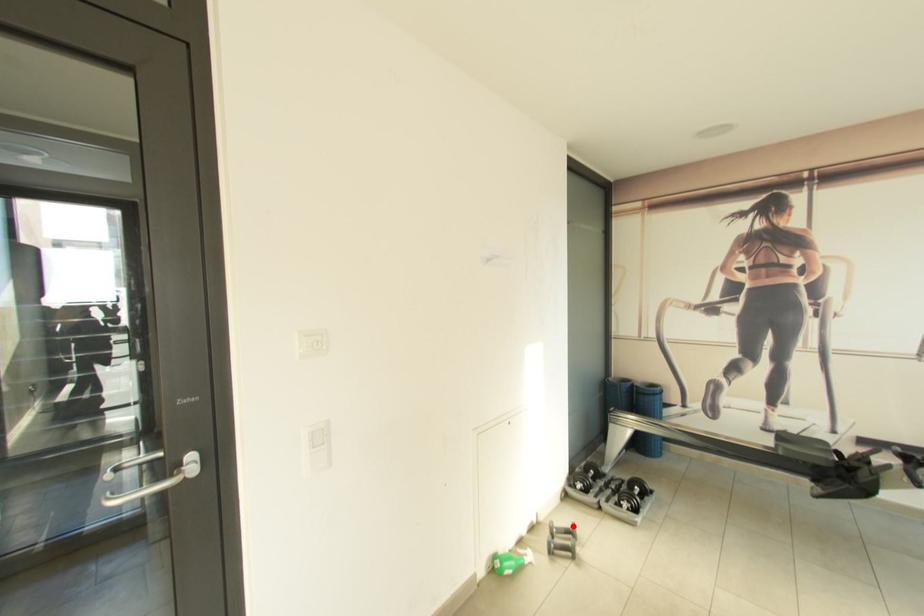
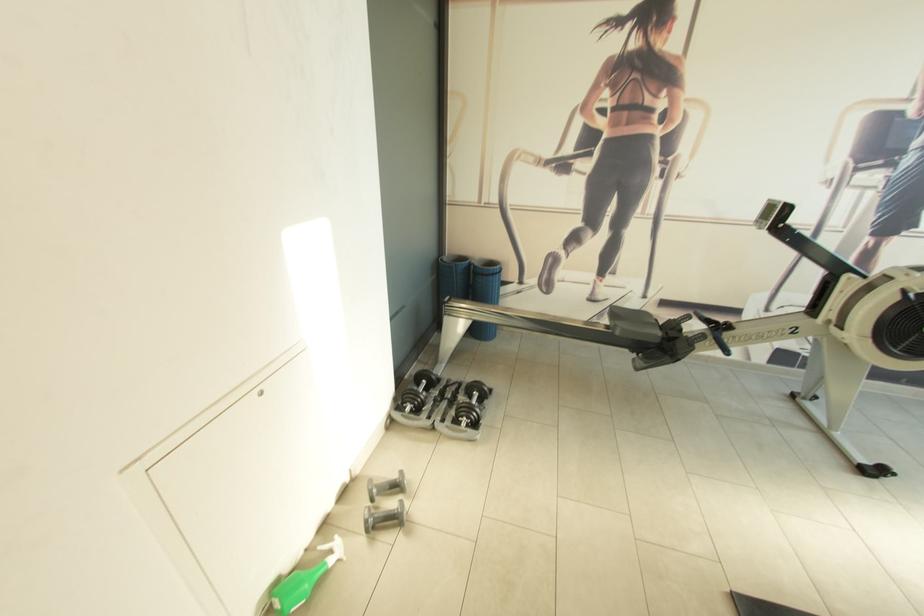
Question: I am providing you with two images of the same scene from different viewpoints. In image1, a red point is highlighted. Considering the same 3D point in image2, which of the following is correct?

Choices:
 (A) It is closer
 (B) It is farther

Answer: (B)